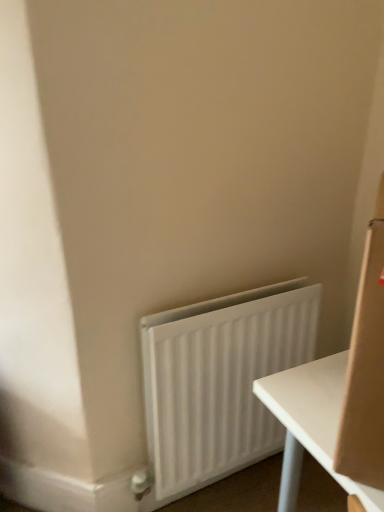
Question: Should I look upward or downward to see white matte radiator at lower right?

Choices:
 (A) down
 (B) up

Answer: (A)